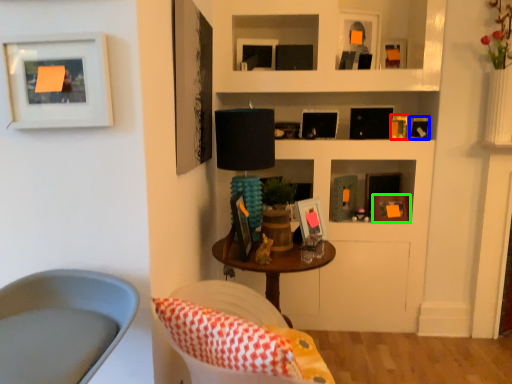
Question: Based on their relative distances, which object is farther from picture frame (highlighted by a red box)? Choose from picture frame (highlighted by a blue box) and picture frame (highlighted by a green box).

Choices:
 (A) picture frame
 (B) picture frame

Answer: (B)